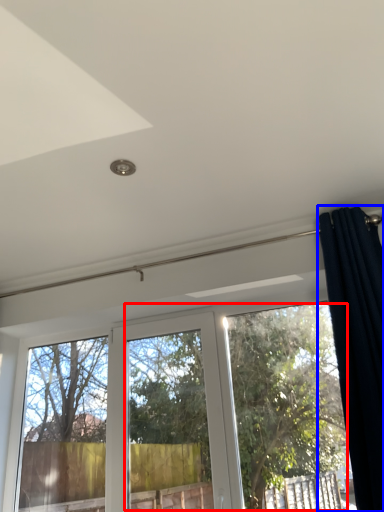
Question: Which object appears farthest to the camera in this image, tree (highlighted by a red box) or curtain (highlighted by a blue box)?

Choices:
 (A) tree
 (B) curtain

Answer: (A)